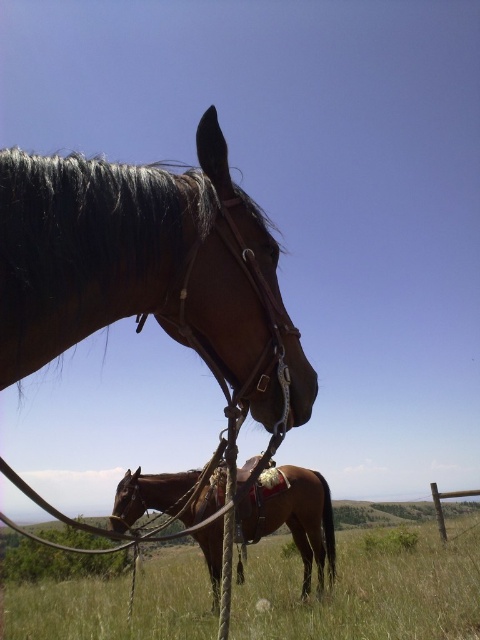
Question: Which is nearer to the brown leather bridle at center?

Choices:
 (A) green grass at lower center
 (B) brown leather saddle at center

Answer: (B)

Question: Is brown leather bridle at center bigger than brown leather saddle at center?

Choices:
 (A) no
 (B) yes

Answer: (A)

Question: Is brown leather bridle at center closer to the viewer compared to brown leather saddle at center?

Choices:
 (A) yes
 (B) no

Answer: (A)

Question: Among these objects, which one is nearest to the camera?

Choices:
 (A) brown leather bridle at center
 (B) green grass at lower center

Answer: (A)

Question: Among these points, which one is farthest from the camera?

Choices:
 (A) (217, 497)
 (B) (424, 602)

Answer: (A)

Question: Does brown leather bridle at center appear under brown leather saddle at center?

Choices:
 (A) no
 (B) yes

Answer: (A)